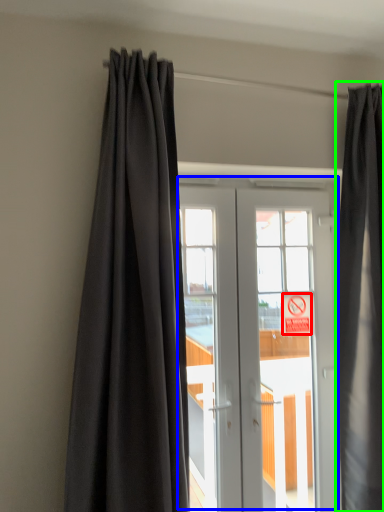
Question: Which object is the closest to the parking sign (highlighted by a red box)? Choose among these: door (highlighted by a blue box) or curtain (highlighted by a green box).

Choices:
 (A) door
 (B) curtain

Answer: (A)